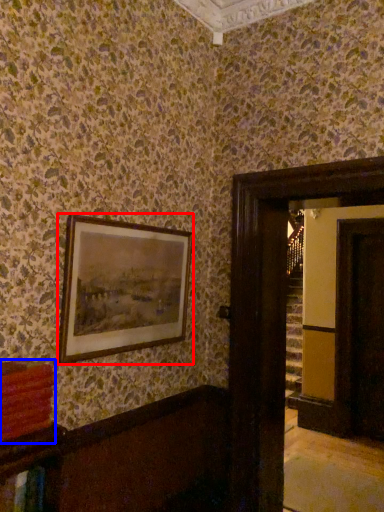
Question: Which object appears closest to the camera in this image, picture frame (highlighted by a red box) or book (highlighted by a blue box)?

Choices:
 (A) picture frame
 (B) book

Answer: (B)